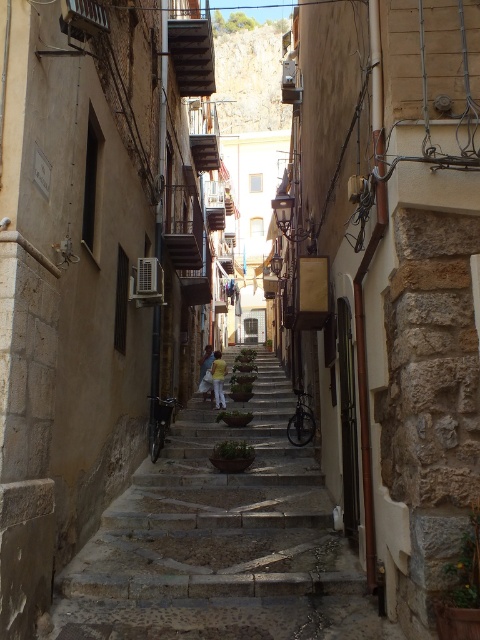
Question: Which object is the farthest from the yellow cotton shirt at center?

Choices:
 (A) stone textured stairs at center
 (B) light blue jeans at center

Answer: (A)

Question: Estimate the real-world distances between objects in this image. Which object is farther from the yellow cotton shirt at center?

Choices:
 (A) stone textured stairs at center
 (B) light blue jeans at center

Answer: (A)

Question: Is stone textured stairs at center to the left of light blue jeans at center from the viewer's perspective?

Choices:
 (A) yes
 (B) no

Answer: (B)

Question: Where is stone textured stairs at center located in relation to light blue jeans at center in the image?

Choices:
 (A) below
 (B) above

Answer: (A)

Question: Does yellow cotton shirt at center have a lesser width compared to light blue jeans at center?

Choices:
 (A) no
 (B) yes

Answer: (A)

Question: Considering the real-world distances, which object is farthest from the stone textured stairs at center?

Choices:
 (A) light blue jeans at center
 (B) yellow cotton shirt at center

Answer: (A)